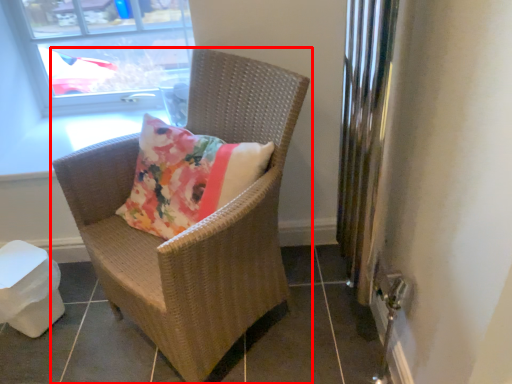
Question: In this image, where is chair (annotated by the red box) located relative to window?

Choices:
 (A) left
 (B) right

Answer: (B)